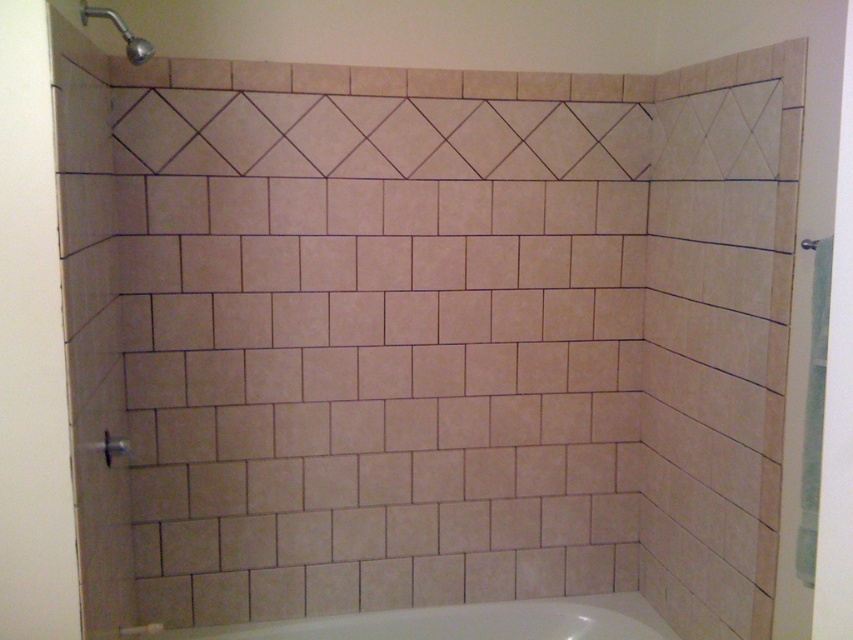
You are standing in the shower area and want to exit through the matte glass screen door at left. Which direction should you move to reach it?

You should move to the left to reach the matte glass screen door at left since it is located at the left side of the shower area.

You are a delivery person holding a 3.5 feet long package and need to enter the shower area through the matte glass screen door at left. Can you fit the package through the opening without tilting it?

The distance between the matte glass screen door at left and the camera is 4.29 feet. Since the package is 3.5 feet long, it is shorter than the available space, so you can fit the package through the opening without tilting it.

You are a delivery person trying to place a large box that is 1.8 meters long in the shower area. The box needs to be placed horizontally. Can the white glossy bathtub at lower center accommodate the box given its length?

The distance between the white glossy bathtub at lower center and the viewer is 2.05 meters, which is greater than the box length of 1.8 meters. Therefore, the white glossy bathtub at lower center can accommodate the box horizontally.